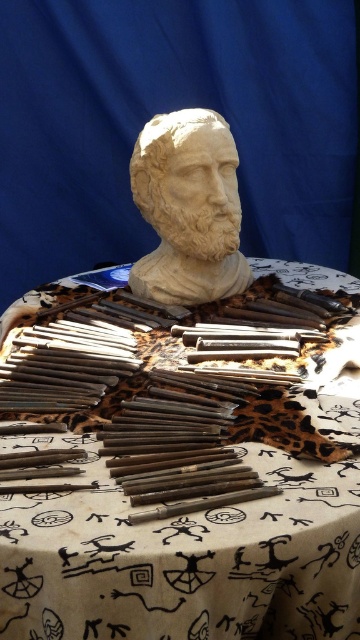
Who is taller, brown wood table at center or matte stone bust at center?

Standing taller between the two is brown wood table at center.

Can you confirm if brown wood table at center is taller than matte stone bust at center?

Yes.

Locate an element on the screen. The height and width of the screenshot is (640, 360). brown wood table at center is located at coordinates (208, 534).

In order to click on brown wood table at center in this screenshot , I will do `click(208, 534)`.